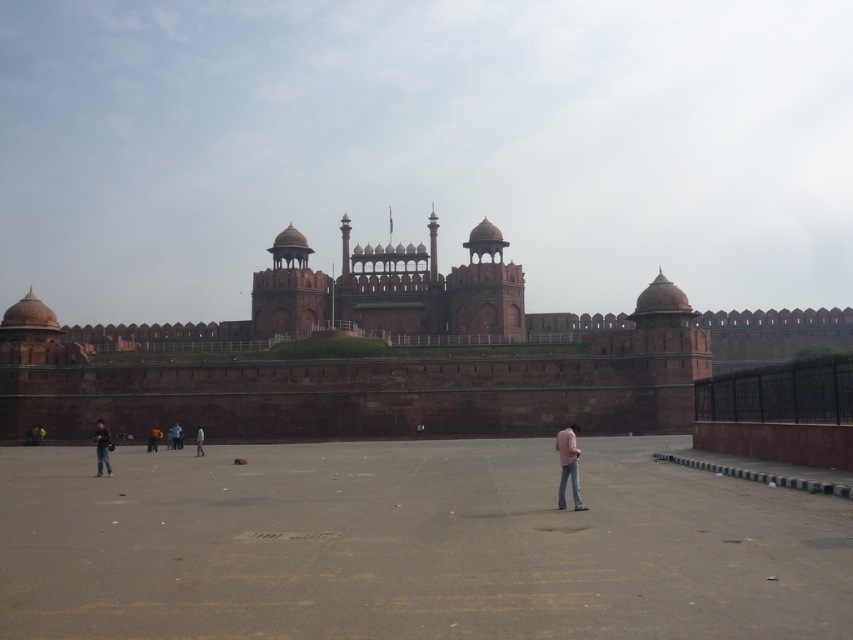
You are a photographer planning to take a photo of the fort. You notice a pink fabric at center and dark blue jeans at lower left in the foreground. Which object should you adjust to ensure the fort remains the main focus of the photo?

The pink fabric at center is positioned over dark blue jeans at lower left, so adjusting the pink fabric at center would help keep the fort as the main focus since it is closer to the camera and might be obscuring the view.

You are a photographer planning to take a photo of the fort. You notice a pink fabric at center and dark blue jeans at lower left in the scene. Which object should you focus on if you want to capture something that appears taller in the frame?

The pink fabric at center is taller than the dark blue jeans at lower left, so you should focus on the pink fabric at center to capture a taller object in the frame.

You are standing in the open paved area in front of the fort. You see a point marked at coordinates (392, 358). What object is located at that point?

The point at coordinates (392, 358) corresponds to the red stone palace at center.